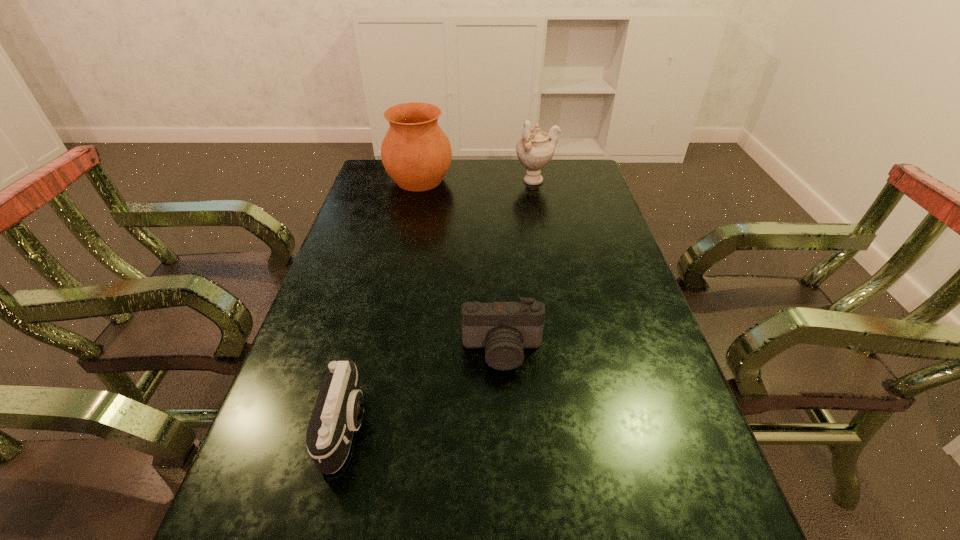
I want to click on vacant area between the pottery and the nearer camera, so click(x=383, y=303).

Image resolution: width=960 pixels, height=540 pixels. Find the location of `object that is the closest to the pottery`. object that is the closest to the pottery is located at coordinates (536, 148).

The image size is (960, 540). Find the location of `the second closest object to the urn`. the second closest object to the urn is located at coordinates (504, 328).

Identify the location of vacant area that satisfies the following two spatial constraints: 1. at the lens of the right camera; 2. on the front lens of the left camera. The width and height of the screenshot is (960, 540). (506, 427).

Locate an element on the screen. The width and height of the screenshot is (960, 540). vacant position in the image that satisfies the following two spatial constraints: 1. on the front side of the pottery; 2. on the right side of the third shortest object is located at coordinates (420, 181).

Locate an element on the screen. The width and height of the screenshot is (960, 540). blank area in the image that satisfies the following two spatial constraints: 1. at the lens of the farther camera; 2. on the front lens of the nearest object is located at coordinates (506, 427).